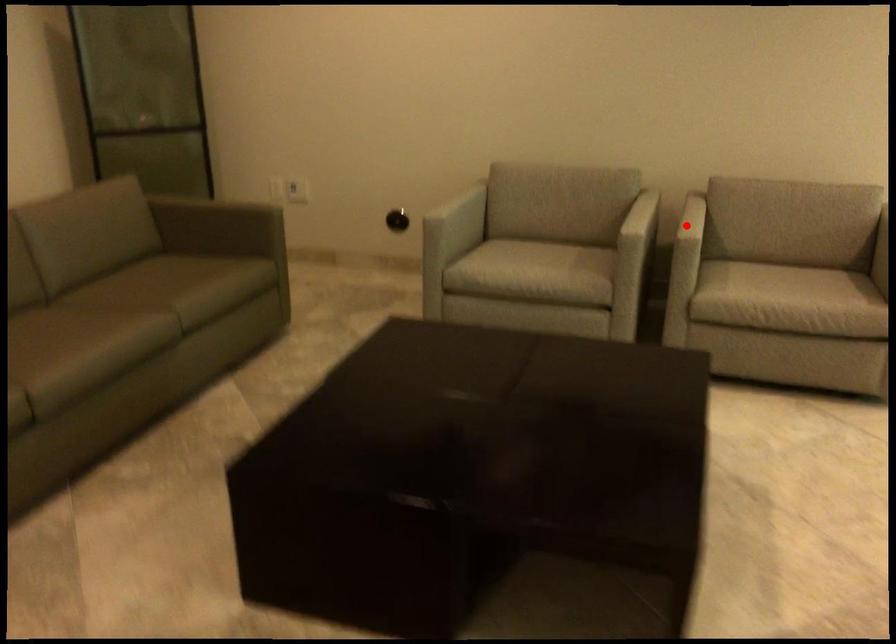
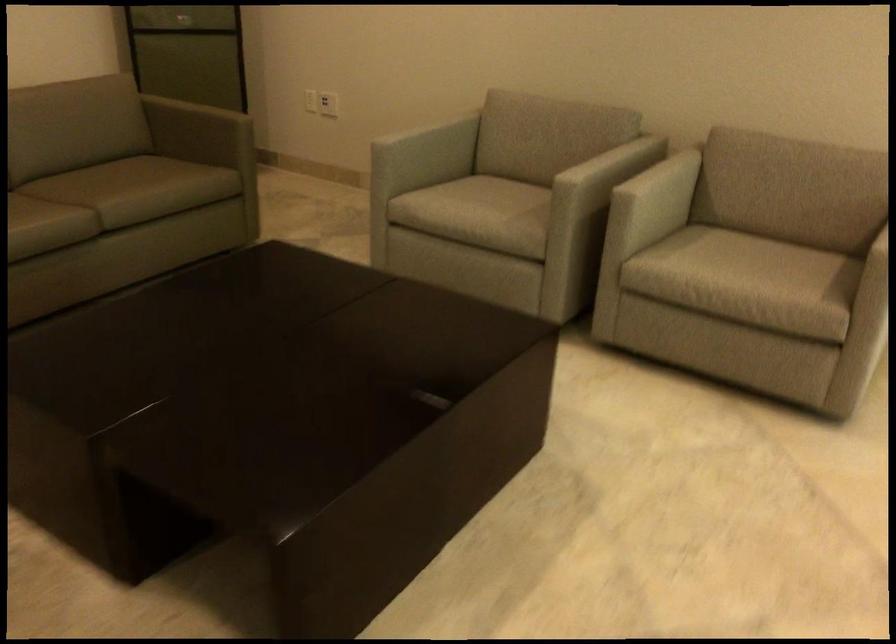
Locate, in the second image, the point that corresponds to the highlighted location in the first image.

(661, 187)